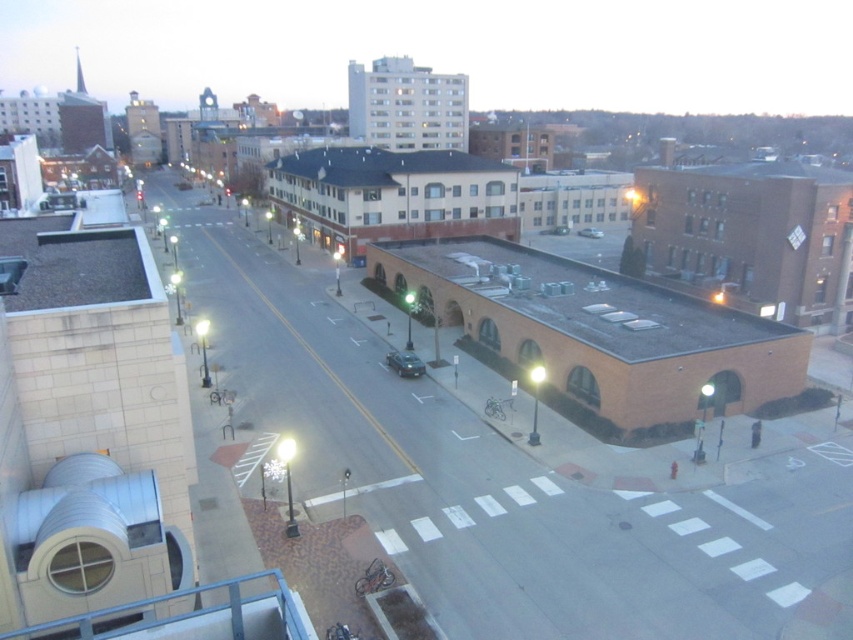
You are a delivery driver needing to park your vehicle between the metallic silver car at center and the silver metallic sedan at center. Given that your car is 4.5 meters long, can you fit your car in the available space between them?

The metallic silver car at center is positioned on the left side of the silver metallic sedan at center. However, the distance between them is not provided in the objects description, so it is impossible to determine if the 4.5 meter long car can fit.

You are a pedestrian standing on the sidewalk. You see a metallic silver car at center and a silver metallic sedan at center. Which vehicle is closer to you?

The metallic silver car at center is closer to you because it is in front of the silver metallic sedan at center.